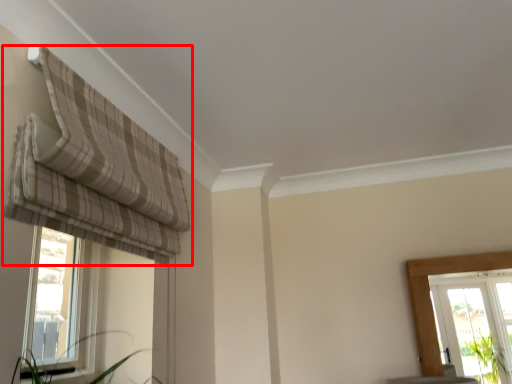
Question: From the image's perspective, what is the correct spatial relationship of curtain (annotated by the red box) in relation to window?

Choices:
 (A) below
 (B) above

Answer: (B)